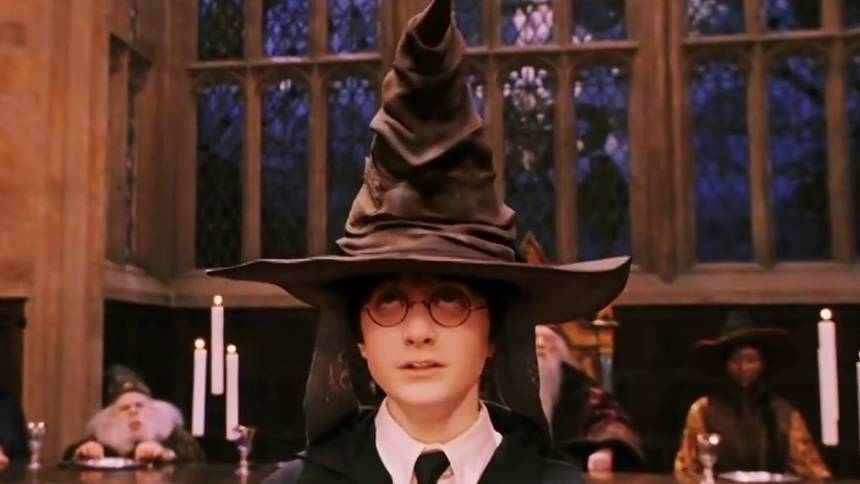
At what (x,y) coordinates should I click in order to perform the action: click on table. Please return your answer as a coordinate pair (x, y). Looking at the image, I should click on (652, 469), (91, 471).